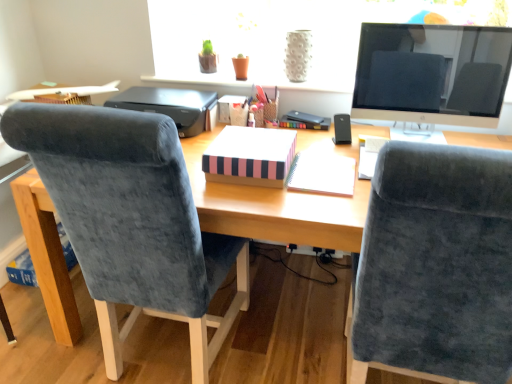
Question: Is black plastic printer at upper center facing towards velvet blue chair at right, the 1th chair in the right-to-left sequence?

Choices:
 (A) yes
 (B) no

Answer: (B)

Question: Is black plastic printer at upper center placed right next to velvet blue chair at right, acting as the second chair starting from the left?

Choices:
 (A) no
 (B) yes

Answer: (A)

Question: From the image's perspective, would you say black plastic printer at upper center is positioned over velvet blue chair at right, the 1th chair in the right-to-left sequence?

Choices:
 (A) no
 (B) yes

Answer: (B)

Question: Is velvet blue chair at right, the 1th chair in the right-to-left sequence, located within black plastic printer at upper center?

Choices:
 (A) yes
 (B) no

Answer: (B)

Question: Is black plastic printer at upper center far away from velvet blue chair at right, the 1th chair in the right-to-left sequence?

Choices:
 (A) no
 (B) yes

Answer: (B)

Question: Is matte black monitor at upper right spatially inside white spiral notebook at center, which is the second notebook from left to right, or outside of it?

Choices:
 (A) outside
 (B) inside

Answer: (A)

Question: From a real-world perspective, is matte black monitor at upper right physically located above or below white spiral notebook at center, which ranks as the first notebook in right-to-left order?

Choices:
 (A) below
 (B) above

Answer: (B)

Question: Relative to white spiral notebook at center, which ranks as the first notebook in right-to-left order, is matte black monitor at upper right in front or behind?

Choices:
 (A) behind
 (B) front

Answer: (A)

Question: In terms of size, does matte black monitor at upper right appear bigger or smaller than white spiral notebook at center, which ranks as the first notebook in right-to-left order?

Choices:
 (A) small
 (B) big

Answer: (B)

Question: Choose the correct answer: Is black plastic printer at upper center inside wooden desk at center or outside it?

Choices:
 (A) inside
 (B) outside

Answer: (B)

Question: Considering the positions of black plastic printer at upper center and wooden desk at center in the image, is black plastic printer at upper center wider or thinner than wooden desk at center?

Choices:
 (A) thin
 (B) wide

Answer: (A)

Question: Considering their positions, is black plastic printer at upper center located in front of or behind wooden desk at center?

Choices:
 (A) front
 (B) behind

Answer: (B)

Question: From a real-world perspective, relative to wooden desk at center, is black plastic printer at upper center vertically above or below?

Choices:
 (A) below
 (B) above

Answer: (B)

Question: Based on their sizes in the image, would you say matte black monitor at upper right is bigger or smaller than velvet blue chair at right, acting as the second chair starting from the left?

Choices:
 (A) big
 (B) small

Answer: (B)

Question: Is matte black monitor at upper right spatially inside velvet blue chair at right, acting as the second chair starting from the left, or outside of it?

Choices:
 (A) outside
 (B) inside

Answer: (A)